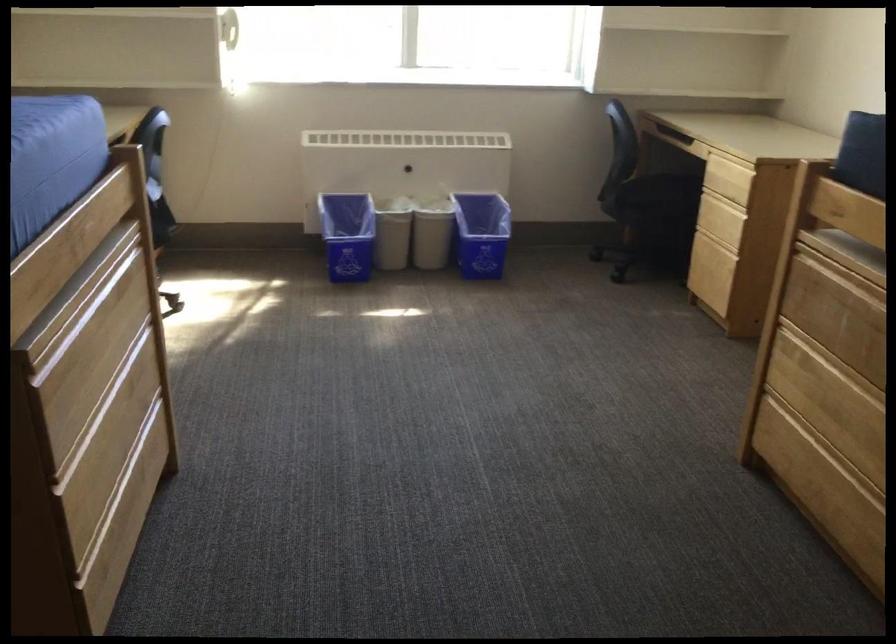
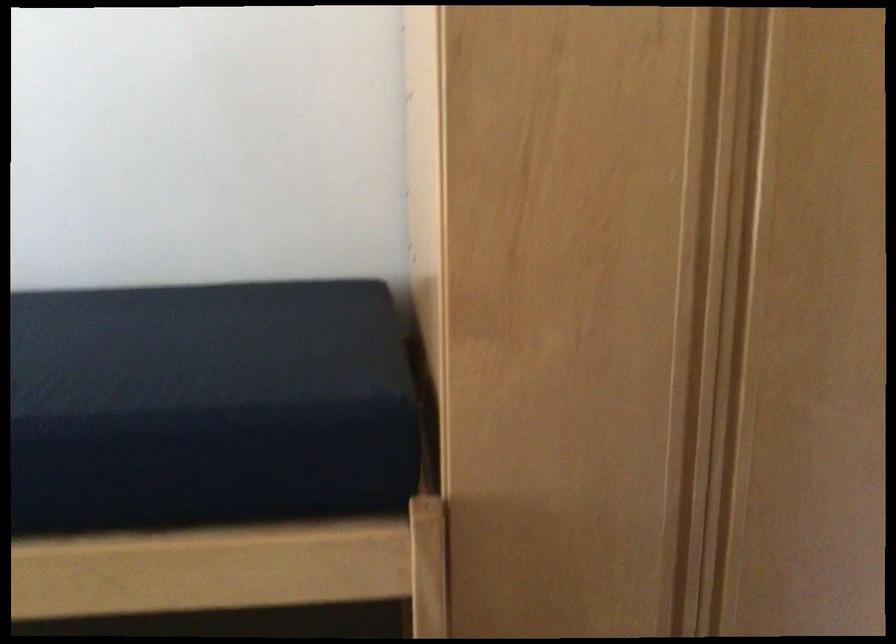
Question: The camera is either moving clockwise (left) or counter-clockwise (right) around the object. The first image is from the beginning of the video and the second image is from the end. Is the camera moving left or right when shooting the video?

Choices:
 (A) Left
 (B) Right

Answer: (A)